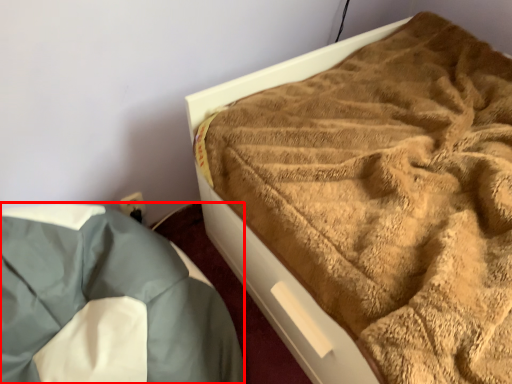
Question: Where is bedding (annotated by the red box) located in relation to bed in the image?

Choices:
 (A) right
 (B) left

Answer: (B)